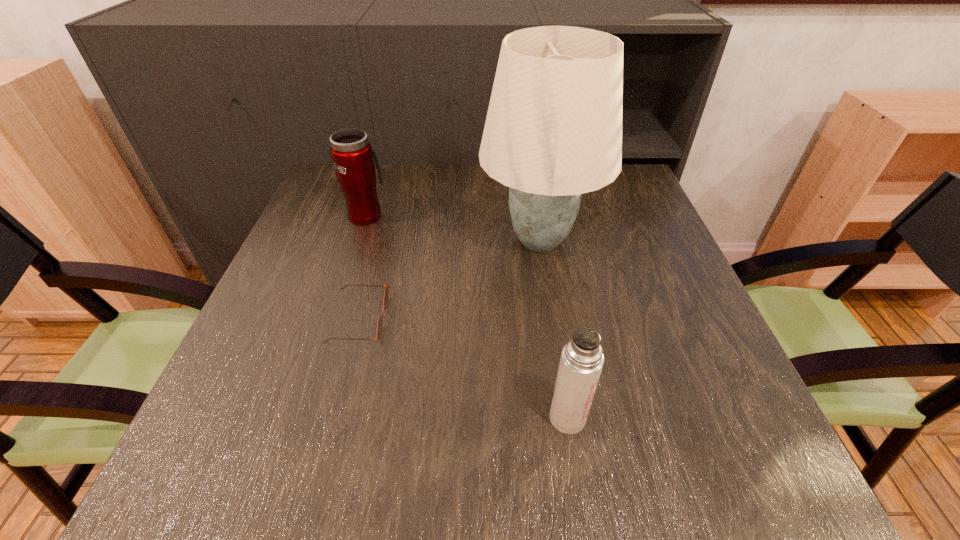
You are a GUI agent. You are given a task and a screenshot of the screen. Output one action in this format:
    pyautogui.click(x=<x>, y=<y>)
    Task: Click on the vacant position at the near edge of the desktop
    The height and width of the screenshot is (540, 960).
    Given the screenshot: What is the action you would take?
    pyautogui.click(x=349, y=486)

Where is `vacant region at the left edge of the desktop`? The width and height of the screenshot is (960, 540). vacant region at the left edge of the desktop is located at coordinates (342, 254).

In order to click on vacant point at the right edge in this screenshot , I will do `click(682, 426)`.

Locate an element on the screen. The width and height of the screenshot is (960, 540). vacant area between the farther thermos bottle and the lampshade is located at coordinates (453, 227).

The height and width of the screenshot is (540, 960). In order to click on vacant region between the tallest object and the right thermos bottle in this screenshot , I will do `click(554, 329)`.

This screenshot has width=960, height=540. Identify the location of empty space that is in between the sunglasses and the lampshade. (449, 279).

What are the coordinates of `free area in between the farther thermos bottle and the nearer thermos bottle` in the screenshot? It's located at (468, 316).

What are the coordinates of `free space that is in between the farther thermos bottle and the tallest object` in the screenshot? It's located at tap(453, 227).

Image resolution: width=960 pixels, height=540 pixels. In order to click on empty location between the shortest object and the right thermos bottle in this screenshot , I will do `click(464, 368)`.

Identify the location of free space between the lampshade and the sunglasses. (449, 279).